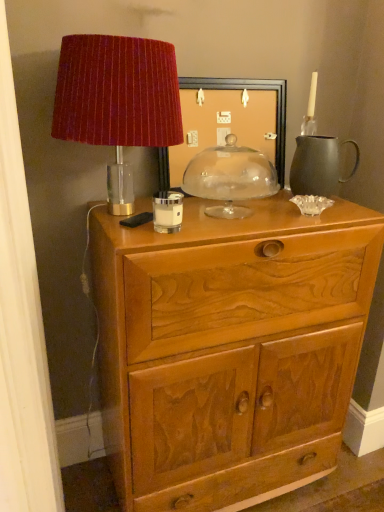
What is the approximate width of transparent glass dome at center, the first candle holder from the back?

transparent glass dome at center, the first candle holder from the back, is 6.47 inches wide.

The width and height of the screenshot is (384, 512). Find the location of `wooden carved chest of drawers at center`. wooden carved chest of drawers at center is located at coordinates [x=229, y=348].

Measure the distance between point (148, 71) and camera.

A distance of 1.00 meters exists between point (148, 71) and camera.

Measure the distance between velvet red lampshade at upper left and camera.

velvet red lampshade at upper left and camera are 37.85 inches apart.

This screenshot has height=512, width=384. Find the location of `matte black pitcher at right`. matte black pitcher at right is located at coordinates (318, 165).

What is the approximate height of white glass candle holder at center, which appears as the first candle holder when viewed from the front?

white glass candle holder at center, which appears as the first candle holder when viewed from the front, is 3.39 inches in height.

This screenshot has height=512, width=384. What do you see at coordinates (167, 211) in the screenshot?
I see `white glass candle holder at center, which ranks as the 2th candle holder in right-to-left order` at bounding box center [167, 211].

At what (x,y) coordinates should I click in order to perform the action: click on transparent glass dome at center, the 2th candle holder positioned from the left. Please return your answer as a coordinate pair (x, y). Image resolution: width=384 pixels, height=512 pixels. Looking at the image, I should click on 230,177.

Who is bigger, white glass candle holder at center, which appears as the first candle holder when viewed from the front, or matte black picture frame at center?

matte black picture frame at center is bigger.

Does point (170, 205) lie in front of point (231, 99)?

Yes.

From a real-world perspective, is white glass candle holder at center, which ranks as the 2th candle holder in right-to-left order, on top of matte black picture frame at center?

No.

Is white glass candle holder at center, which appears as the first candle holder when viewed from the front, taller than matte black picture frame at center?

No, white glass candle holder at center, which appears as the first candle holder when viewed from the front, is not taller than matte black picture frame at center.

From their relative heights in the image, would you say velvet red lampshade at upper left is taller or shorter than matte black pitcher at right?

Clearly, velvet red lampshade at upper left is taller compared to matte black pitcher at right.

Consider the image. From the image's perspective, which one is positioned lower, velvet red lampshade at upper left or matte black pitcher at right?

matte black pitcher at right.

Does velvet red lampshade at upper left have a smaller size compared to matte black pitcher at right?

No, velvet red lampshade at upper left is not smaller than matte black pitcher at right.

Is velvet red lampshade at upper left behind matte black pitcher at right?

No, velvet red lampshade at upper left is closer to the viewer.

In the scene shown: Which of these two, wooden carved chest of drawers at center or matte black picture frame at center, stands shorter?

matte black picture frame at center is shorter.

Can matte black picture frame at center be found inside wooden carved chest of drawers at center?

No, wooden carved chest of drawers at center does not contain matte black picture frame at center.

Is wooden carved chest of drawers at center in contact with transparent glass dome at center, the 2th candle holder positioned from the left?

No.

Can transparent glass dome at center, which appears as the 1th candle holder when viewed from the right, be found inside wooden carved chest of drawers at center?

Definitely not — transparent glass dome at center, which appears as the 1th candle holder when viewed from the right, is not inside wooden carved chest of drawers at center.

You are a GUI agent. You are given a task and a screenshot of the screen. Output one action in this format:
    pyautogui.click(x=<x>, y=<y>)
    Task: Click on the candle holder that is the 2nd object located behind the wooden carved chest of drawers at center
    The width and height of the screenshot is (384, 512).
    Given the screenshot: What is the action you would take?
    pyautogui.click(x=230, y=177)

Can you tell me how much wooden carved chest of drawers at center and transparent glass dome at center, the 2th candle holder positioned from the left, differ in facing direction?

The angle between the facing direction of wooden carved chest of drawers at center and the facing direction of transparent glass dome at center, the 2th candle holder positioned from the left, is 0.763 degrees.

How far apart are matte black picture frame at center and velvet red lampshade at upper left?

33.30 centimeters.

Does matte black picture frame at center touch velvet red lampshade at upper left?

There is a gap between matte black picture frame at center and velvet red lampshade at upper left.

Considering the points (213, 123) and (119, 37), which point is behind, point (213, 123) or point (119, 37)?

The point (213, 123) is more distant.

Locate an element on the screen. The width and height of the screenshot is (384, 512). lamp that is below the matte black picture frame at center (from the image's perspective) is located at coordinates (117, 101).

Considering the relative positions of matte black pitcher at right and velvet red lampshade at upper left in the image provided, is matte black pitcher at right to the left of velvet red lampshade at upper left from the viewer's perspective?

No, matte black pitcher at right is not to the left of velvet red lampshade at upper left.

Between matte black pitcher at right and velvet red lampshade at upper left, which one is positioned in front?

Positioned in front is velvet red lampshade at upper left.

From a real-world perspective, is matte black pitcher at right physically below velvet red lampshade at upper left?

Yes, from a real-world perspective, matte black pitcher at right is below velvet red lampshade at upper left.

Is matte black pitcher at right positioned far away from velvet red lampshade at upper left?

No.

From the image's perspective, is matte black picture frame at center above or below wooden carved chest of drawers at center?

Clearly, from the image's perspective, matte black picture frame at center is above wooden carved chest of drawers at center.

Does matte black picture frame at center touch wooden carved chest of drawers at center?

matte black picture frame at center and wooden carved chest of drawers at center are not in contact.

Which of these two, matte black picture frame at center or wooden carved chest of drawers at center, is wider?

wooden carved chest of drawers at center.

From a real-world perspective, is matte black picture frame at center below wooden carved chest of drawers at center?

No, from a real-world perspective, matte black picture frame at center is not under wooden carved chest of drawers at center.

From a real-world perspective, count 2nd candle holders downward from the matte black picture frame at center and point to it. Please provide its 2D coordinates.

[(167, 211)]

Locate an element on the screen. This screenshot has height=512, width=384. tea pot lying on the right of velvet red lampshade at upper left is located at coordinates (318, 165).

Based on the photo, from the image, which object appears to be nearer to matte black pitcher at right, velvet red lampshade at upper left or transparent glass dome at center, the 2th candle holder positioned from the left?

transparent glass dome at center, the 2th candle holder positioned from the left, lies closer to matte black pitcher at right than the other object.

Looking at the image, which one is located closer to wooden carved chest of drawers at center, velvet red lampshade at upper left or matte black pitcher at right?

velvet red lampshade at upper left is closer to wooden carved chest of drawers at center.

Looking at the image, which one is located closer to velvet red lampshade at upper left, matte black pitcher at right or white glass candle holder at center, which appears as the first candle holder when viewed from the front?

Among the two, white glass candle holder at center, which appears as the first candle holder when viewed from the front, is located nearer to velvet red lampshade at upper left.

Which object lies nearer to the anchor point white glass candle holder at center, the second candle holder viewed from the back, wooden carved chest of drawers at center or velvet red lampshade at upper left?

velvet red lampshade at upper left is positioned closer to the anchor white glass candle holder at center, the second candle holder viewed from the back.

Estimate the real-world distances between objects in this image. Which object is further from transparent glass dome at center, the first candle holder from the back, wooden carved chest of drawers at center or matte black pitcher at right?

wooden carved chest of drawers at center is positioned further to the anchor transparent glass dome at center, the first candle holder from the back.

Looking at the image, which one is located closer to transparent glass dome at center, which appears as the 1th candle holder when viewed from the right, white glass candle holder at center, which appears as the first candle holder when viewed from the front, or wooden carved chest of drawers at center?

white glass candle holder at center, which appears as the first candle holder when viewed from the front, is closer to transparent glass dome at center, which appears as the 1th candle holder when viewed from the right.

Based on their spatial positions, is matte black pitcher at right or wooden carved chest of drawers at center further from matte black picture frame at center?

wooden carved chest of drawers at center lies further to matte black picture frame at center than the other object.

Based on their spatial positions, is matte black pitcher at right or transparent glass dome at center, the 2th candle holder positioned from the left, closer to velvet red lampshade at upper left?

transparent glass dome at center, the 2th candle holder positioned from the left, is closer to velvet red lampshade at upper left.

The height and width of the screenshot is (512, 384). What are the coordinates of `candle holder between white glass candle holder at center, which ranks as the 2th candle holder in right-to-left order, and matte black pitcher at right` in the screenshot? It's located at (230, 177).

The image size is (384, 512). I want to click on candle holder between transparent glass dome at center, which appears as the 1th candle holder when viewed from the right, and wooden carved chest of drawers at center, in the vertical direction, so (167, 211).

Locate an element on the screen. This screenshot has width=384, height=512. candle holder between matte black picture frame at center and matte black pitcher at right in the horizontal direction is located at coordinates (230, 177).

The width and height of the screenshot is (384, 512). I want to click on lamp between matte black picture frame at center and wooden carved chest of drawers at center in the up-down direction, so click(117, 101).